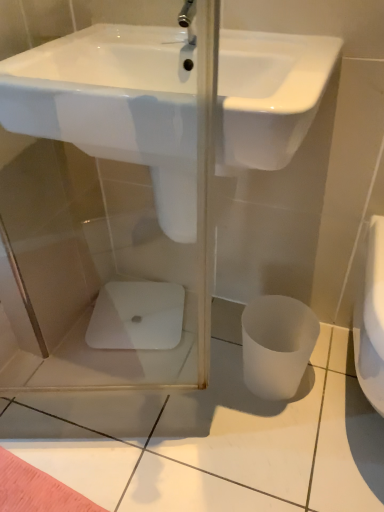
Question: Considering the relative sizes of white glossy porcelain at center and white matte toilet bowl at lower right in the image provided, is white glossy porcelain at center bigger than white matte toilet bowl at lower right?

Choices:
 (A) yes
 (B) no

Answer: (B)

Question: From the image's perspective, is white glossy porcelain at center located above white matte toilet bowl at lower right?

Choices:
 (A) no
 (B) yes

Answer: (B)

Question: Is the depth of white glossy porcelain at center less than that of white matte toilet bowl at lower right?

Choices:
 (A) no
 (B) yes

Answer: (A)

Question: Is white matte toilet bowl at lower right completely or partially inside white glossy porcelain at center?

Choices:
 (A) no
 (B) yes

Answer: (A)

Question: Would you say white glossy porcelain at center is outside white matte toilet bowl at lower right?

Choices:
 (A) no
 (B) yes

Answer: (B)

Question: From their relative heights in the image, would you say white glossy porcelain at center is taller or shorter than white glossy sink at upper center?

Choices:
 (A) tall
 (B) short

Answer: (B)

Question: Looking at the image, does white glossy porcelain at center seem bigger or smaller compared to white glossy sink at upper center?

Choices:
 (A) big
 (B) small

Answer: (B)

Question: Is white glossy porcelain at center in front of or behind white glossy sink at upper center in the image?

Choices:
 (A) behind
 (B) front

Answer: (A)

Question: Considering the positions of white glossy porcelain at center and white glossy sink at upper center in the image, is white glossy porcelain at center wider or thinner than white glossy sink at upper center?

Choices:
 (A) wide
 (B) thin

Answer: (B)

Question: Looking at their shapes, would you say white matte toilet bowl at lower right is wider or thinner than white glossy sink at upper center?

Choices:
 (A) wide
 (B) thin

Answer: (B)

Question: Choose the correct answer: Is white matte toilet bowl at lower right inside white glossy sink at upper center or outside it?

Choices:
 (A) inside
 (B) outside

Answer: (B)

Question: Considering their positions, is white matte toilet bowl at lower right located in front of or behind white glossy sink at upper center?

Choices:
 (A) front
 (B) behind

Answer: (B)

Question: From a real-world perspective, is white matte toilet bowl at lower right above or below white glossy sink at upper center?

Choices:
 (A) above
 (B) below

Answer: (B)

Question: Considering the positions of white glossy sink at upper center and white glossy porcelain at center in the image, is white glossy sink at upper center bigger or smaller than white glossy porcelain at center?

Choices:
 (A) big
 (B) small

Answer: (A)

Question: From the image's perspective, is white glossy sink at upper center located above or below white glossy porcelain at center?

Choices:
 (A) below
 (B) above

Answer: (B)